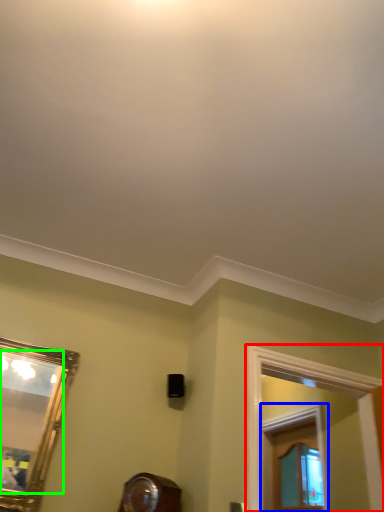
Question: Which object is positioned farthest from window frame (highlighted by a red box)? Select from window frame (highlighted by a blue box) and mirror (highlighted by a green box).

Choices:
 (A) window frame
 (B) mirror

Answer: (B)